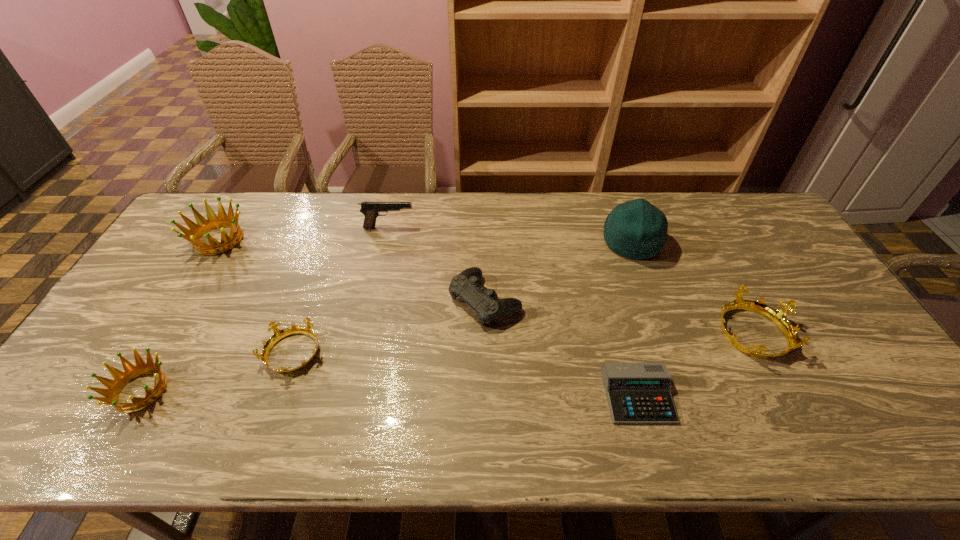
Locate an element on the screen. the tallest object is located at coordinates (636, 229).

The width and height of the screenshot is (960, 540). I want to click on the fourth object from left to right, so click(x=371, y=210).

The image size is (960, 540). I want to click on black pistol, so click(371, 210).

The height and width of the screenshot is (540, 960). In order to click on the tallest crown in this screenshot , I will do `click(203, 226)`.

Find the location of a particular element. The image size is (960, 540). the bigger golden crown is located at coordinates (203, 226).

Locate an element on the screen. the bigger gold crown is located at coordinates (778, 317).

Locate an element on the screen. The image size is (960, 540). the rightmost crown is located at coordinates (778, 317).

You are a GUI agent. You are given a task and a screenshot of the screen. Output one action in this format:
    pyautogui.click(x=<x>, y=<y>)
    Task: Click on the control
    The height and width of the screenshot is (540, 960).
    Given the screenshot: What is the action you would take?
    pyautogui.click(x=467, y=285)

Find the location of a particular element. The width and height of the screenshot is (960, 540). the smaller golden crown is located at coordinates (114, 387).

Image resolution: width=960 pixels, height=540 pixels. I want to click on the second crown from right to left, so click(x=278, y=334).